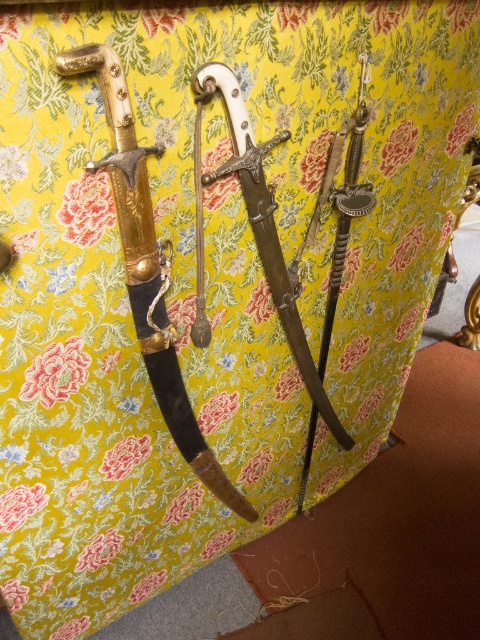
Which is more to the right, gold plated dagger at left or polished silver sword at center?

From the viewer's perspective, polished silver sword at center appears more on the right side.

Can you confirm if gold plated dagger at left is positioned to the right of polished silver sword at center?

In fact, gold plated dagger at left is to the left of polished silver sword at center.

The width and height of the screenshot is (480, 640). I want to click on gold plated dagger at left, so click(x=147, y=268).

Is polished silver dagger at center wider than polished silver sword at center?

Indeed, polished silver dagger at center has a greater width compared to polished silver sword at center.

Can you confirm if polished silver dagger at center is taller than polished silver sword at center?

No, polished silver dagger at center is not taller than polished silver sword at center.

Describe the element at coordinates (264, 225) in the screenshot. The height and width of the screenshot is (640, 480). I see `polished silver dagger at center` at that location.

Image resolution: width=480 pixels, height=640 pixels. I want to click on polished silver dagger at center, so click(264, 225).

Between gold plated dagger at left and polished silver dagger at center, which one has more height?

With more height is gold plated dagger at left.

Which is below, gold plated dagger at left or polished silver dagger at center?

Positioned lower is gold plated dagger at left.

Measure the distance between gold plated dagger at left and camera.

74.11 centimeters

The image size is (480, 640). Identify the location of gold plated dagger at left. (147, 268).